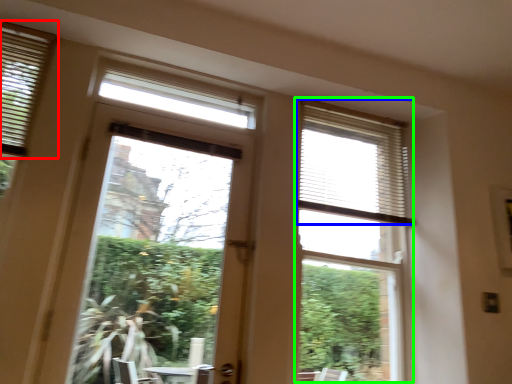
Question: Considering the real-world distances, which object is closest to window blind (highlighted by a red box)? blind (highlighted by a blue box) or bay window (highlighted by a green box).

Choices:
 (A) blind
 (B) bay window

Answer: (A)